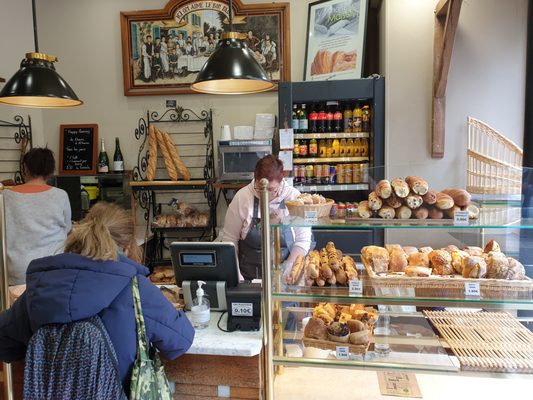
This screenshot has width=533, height=400. I want to click on wooden rack, so click(492, 331).